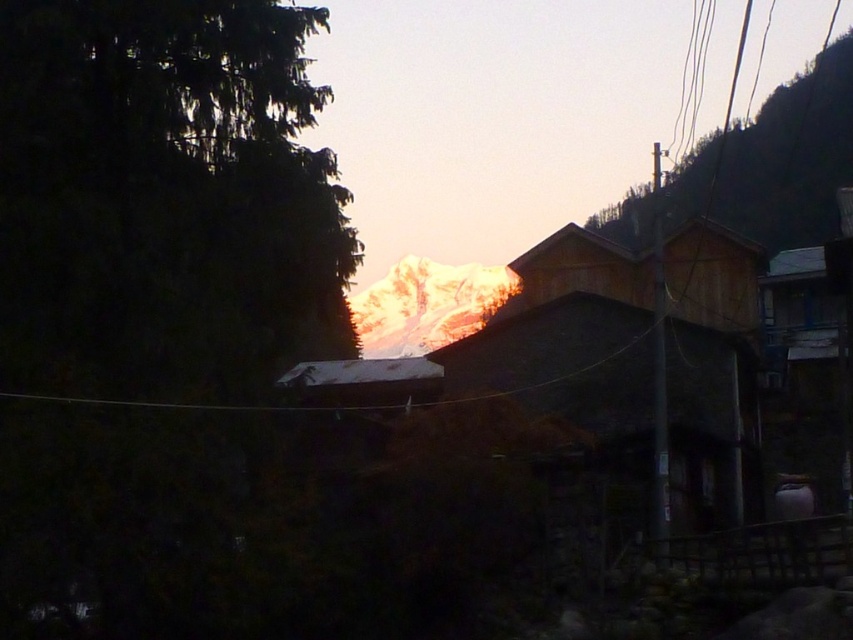
Is the position of green matte tree at left more distant than that of wooden hut at center?

No.

Who is shorter, green matte tree at left or wooden hut at center?

green matte tree at left is shorter.

Does point (165, 148) come farther from viewer compared to point (593, 314)?

No, it is not.

Find the location of a particular element. The image size is (853, 640). green matte tree at left is located at coordinates (161, 193).

Does point (550, 260) come in front of point (718, 182)?

Yes, point (550, 260) is closer to viewer.

Image resolution: width=853 pixels, height=640 pixels. In order to click on wooden hut at center in this screenshot , I will do `click(570, 340)`.

Is green matte tree at left above green textured hillside at upper right?

No, green matte tree at left is not above green textured hillside at upper right.

Between green matte tree at left and green textured hillside at upper right, which one is positioned lower?

green matte tree at left is below.

Describe the element at coordinates (161, 193) in the screenshot. I see `green matte tree at left` at that location.

Identify the location of green matte tree at left. (161, 193).